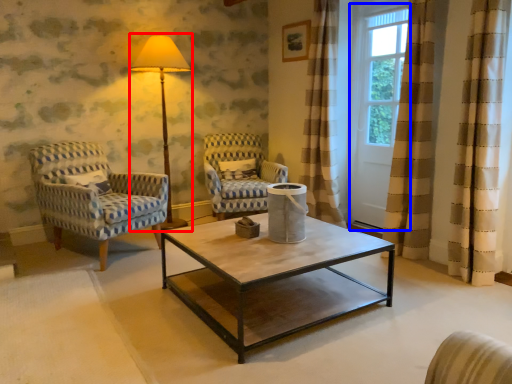
Question: Which of the following is the farthest to the observer, table lamp (highlighted by a red box) or screen door (highlighted by a blue box)?

Choices:
 (A) table lamp
 (B) screen door

Answer: (A)